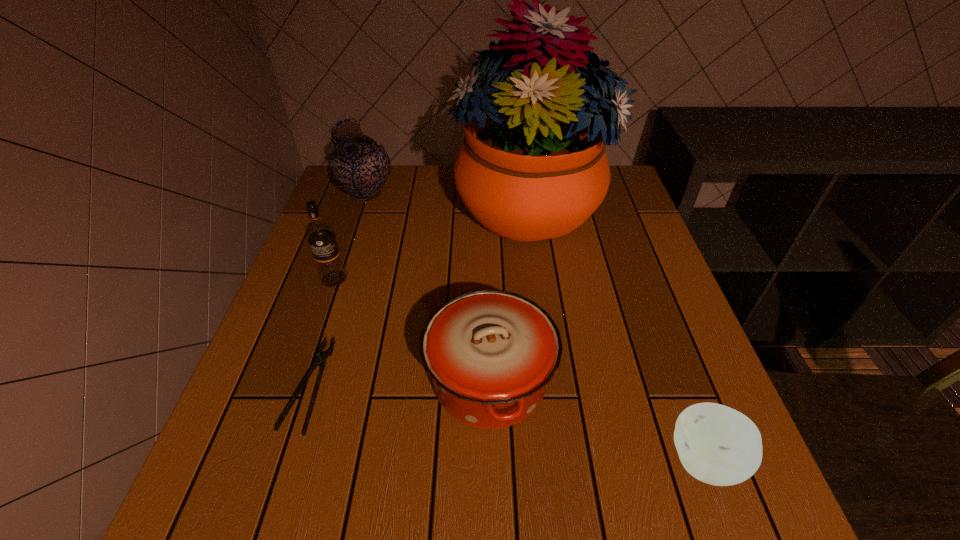
Where is `vacant space situated on the back of the apple`? vacant space situated on the back of the apple is located at coordinates (657, 328).

This screenshot has width=960, height=540. Identify the location of vacant space located on the back of the tongs. (329, 320).

Where is `flower arrangement that is at the far edge`? This screenshot has height=540, width=960. flower arrangement that is at the far edge is located at coordinates [533, 166].

Identify the location of pottery present at the far edge. The image size is (960, 540). coord(359,166).

This screenshot has width=960, height=540. In order to click on object that is at the near edge in this screenshot , I will do `click(718, 445)`.

The width and height of the screenshot is (960, 540). In order to click on vodka present at the left edge in this screenshot , I will do `click(320, 234)`.

In order to click on pottery positioned at the left edge in this screenshot , I will do `click(359, 166)`.

Where is `tongs located at the left edge`? This screenshot has width=960, height=540. tongs located at the left edge is located at coordinates point(320,361).

Where is `flower arrangement situated at the right edge`? Image resolution: width=960 pixels, height=540 pixels. flower arrangement situated at the right edge is located at coordinates (533, 166).

You are a GUI agent. You are given a task and a screenshot of the screen. Output one action in this format:
    pyautogui.click(x=<x>, y=<y>)
    Task: Click on the apple situated at the right edge
    The height and width of the screenshot is (540, 960).
    Given the screenshot: What is the action you would take?
    pyautogui.click(x=718, y=445)